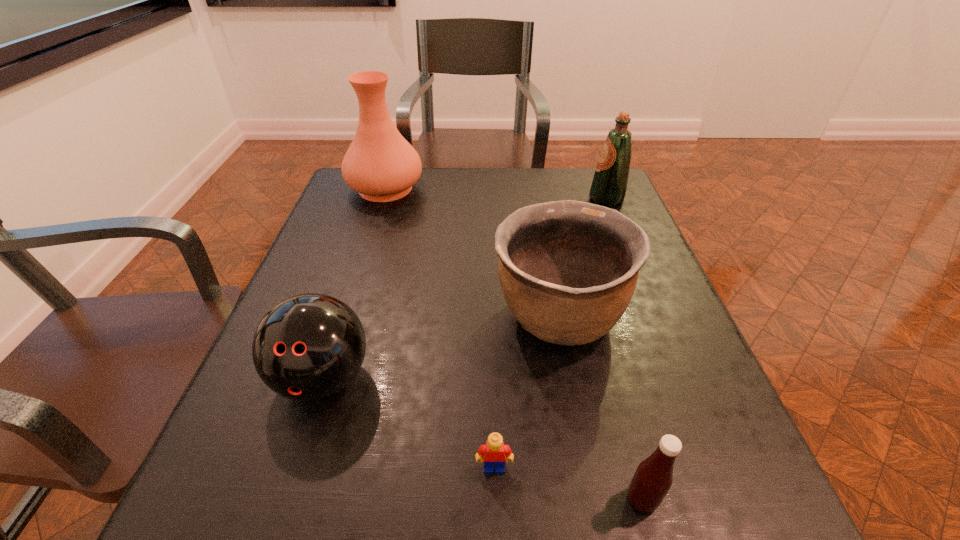
Locate an element on the screen. This screenshot has height=540, width=960. bowling ball located in the left edge section of the desktop is located at coordinates (308, 347).

This screenshot has width=960, height=540. I want to click on olive oil positioned at the right edge, so [x=609, y=185].

Find the location of `pottery that is positioned at the right edge`. pottery that is positioned at the right edge is located at coordinates 568,269.

You are a GUI agent. You are given a task and a screenshot of the screen. Output one action in this format:
    pyautogui.click(x=<x>, y=<y>)
    Task: Click on the Tabasco sauce located at the right edge
    This screenshot has width=960, height=540.
    Given the screenshot: What is the action you would take?
    pyautogui.click(x=653, y=478)

The image size is (960, 540). Find the location of `object that is at the far left corner`. object that is at the far left corner is located at coordinates (380, 164).

At what (x,y) coordinates should I click in order to perform the action: click on object at the far right corner. Please return your answer as a coordinate pair (x, y). This screenshot has width=960, height=540. Looking at the image, I should click on (609, 185).

Find the location of a particular element. This screenshot has height=540, width=960. object that is at the near right corner is located at coordinates (653, 478).

I want to click on blank space at the far edge of the desktop, so click(462, 178).

Image resolution: width=960 pixels, height=540 pixels. Identify the location of free region at the near edge of the desktop. [x=369, y=492].

This screenshot has width=960, height=540. In order to click on blank space at the left edge in this screenshot , I will do `click(391, 212)`.